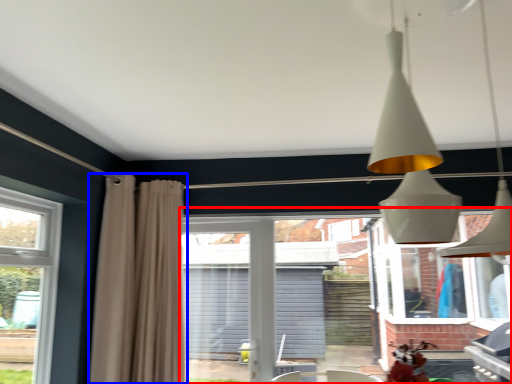
Question: Among these objects, which one is farthest to the camera, backyard (highlighted by a red box) or curtain (highlighted by a blue box)?

Choices:
 (A) backyard
 (B) curtain

Answer: (A)